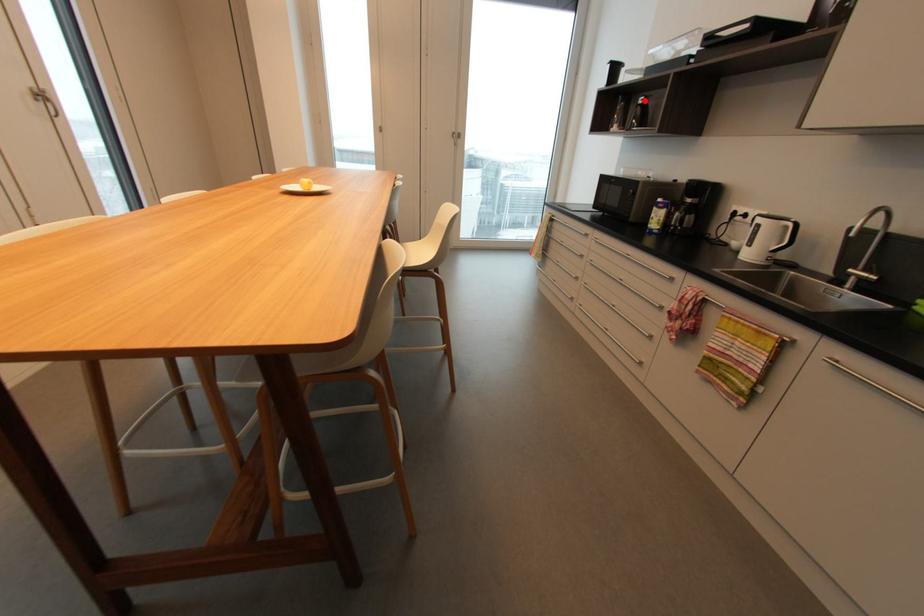
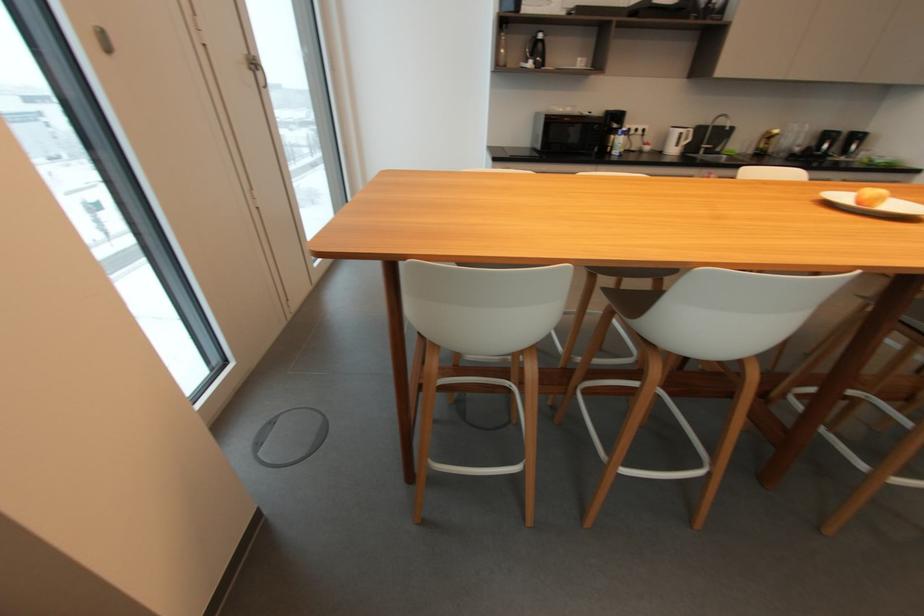
In the second image, find the point that corresponds to the highlighted location in the first image.

(544, 36)